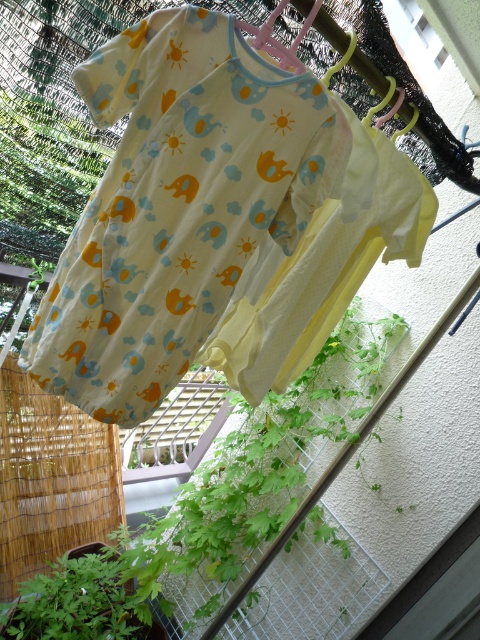
Question: Which object is the closest to the green leafy plant at lower left?

Choices:
 (A) matte yellow fabric baby clothes at center
 (B) green leafy plant at center

Answer: (B)

Question: Which of the following is the farthest from the observer?

Choices:
 (A) (175, 13)
 (B) (95, 552)

Answer: (B)

Question: Is green leafy plant at center wider than green leafy plant at lower left?

Choices:
 (A) no
 (B) yes

Answer: (B)

Question: Which point is farther to the camera?

Choices:
 (A) (x=44, y=600)
 (B) (x=328, y=349)
 (C) (x=212, y=292)

Answer: (B)

Question: Is matte yellow fabric baby clothes at center to the right of green leafy plant at center from the viewer's perspective?

Choices:
 (A) yes
 (B) no

Answer: (B)

Question: In this image, where is green leafy plant at center located relative to green leafy plant at lower left?

Choices:
 (A) below
 (B) above

Answer: (B)